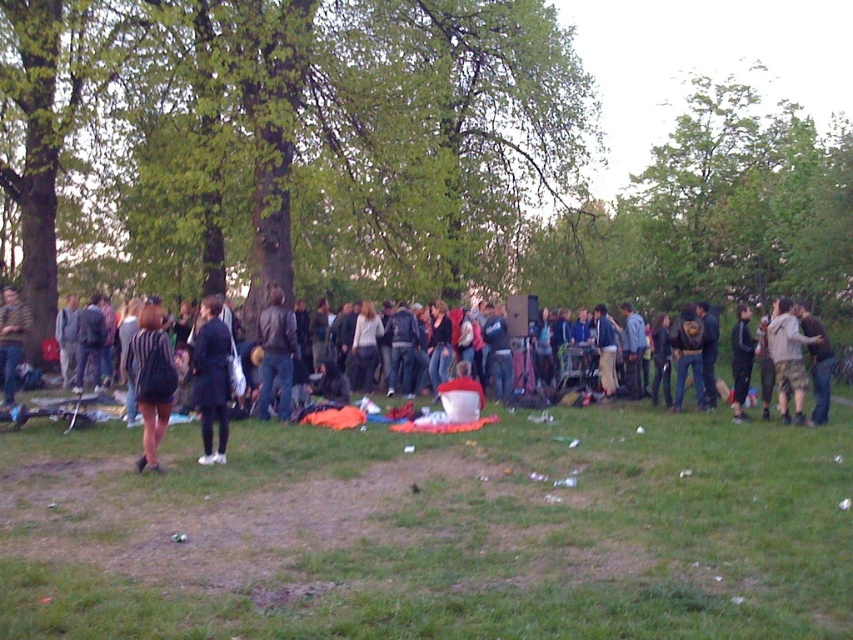
Question: Is green leafy tree at center positioned at the back of dark brown leather jacket at right?

Choices:
 (A) yes
 (B) no

Answer: (A)

Question: Which point appears closest to the camera in this image?

Choices:
 (A) (819, 401)
 (B) (9, 376)

Answer: (A)

Question: Which point is farther to the camera?

Choices:
 (A) striped fabric dress at center
 (B) dark brown leather jacket at right
 (C) green grass at lower center
 (D) dark blue jeans at center

Answer: (D)

Question: Which is nearer to the green grass at lower center?

Choices:
 (A) dark blue jeans at center
 (B) dark blue jacket at center
 (C) green leafy tree at center

Answer: (B)

Question: Can you confirm if green leafy tree at center is wider than striped shirt at center?

Choices:
 (A) yes
 (B) no

Answer: (A)

Question: Does striped fabric dress at center have a smaller size compared to camouflage pants at right?

Choices:
 (A) yes
 (B) no

Answer: (A)